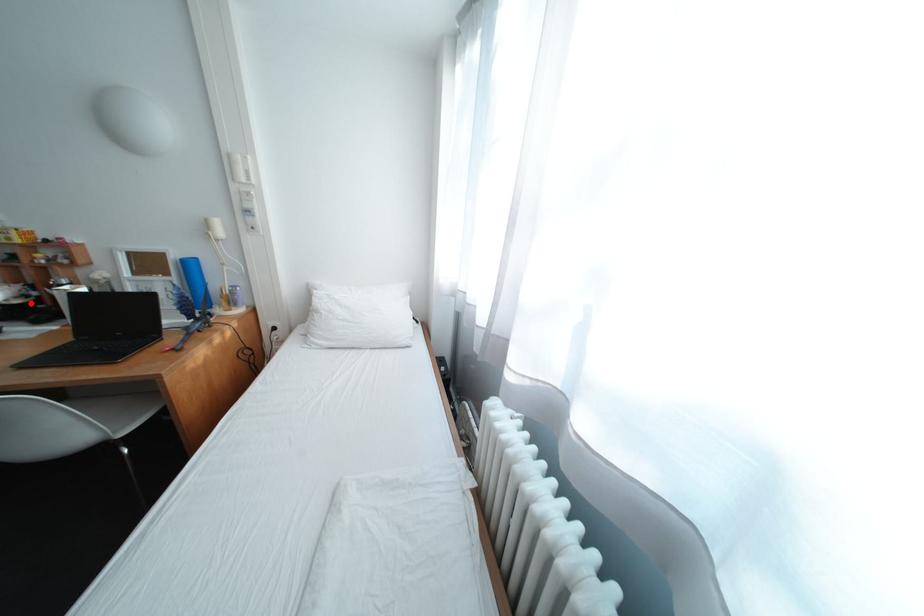
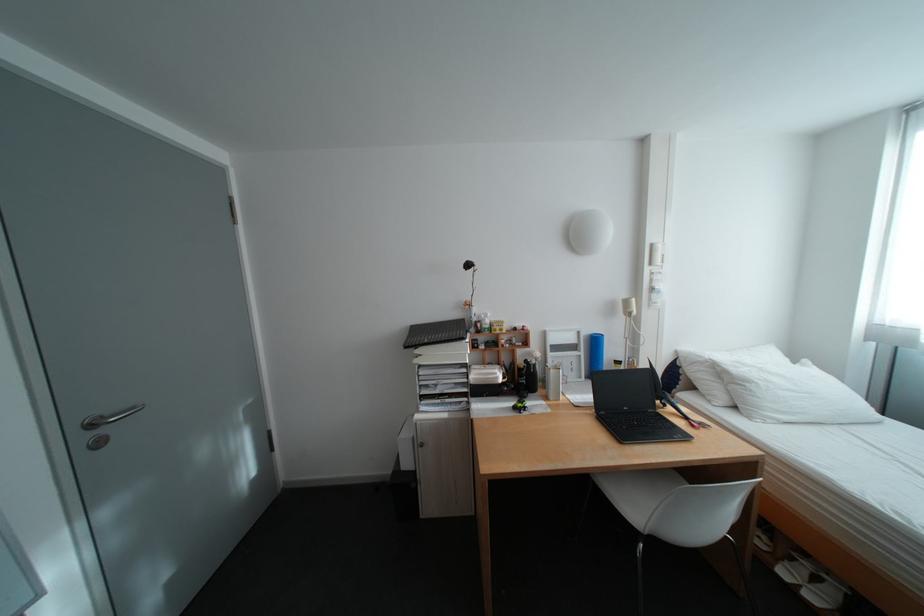
Where in the second image is the point corresponding to the highlighted location from the first image?

(518, 381)